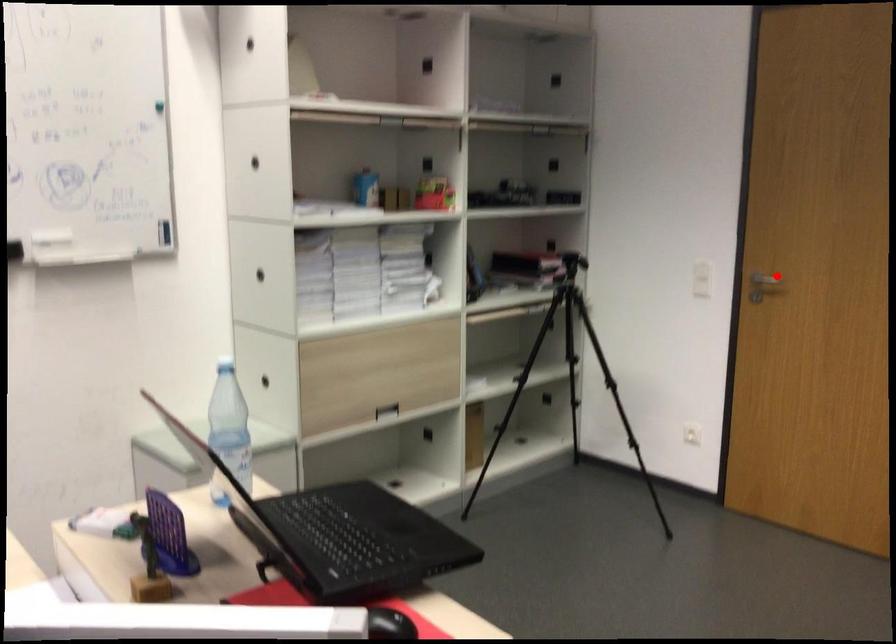
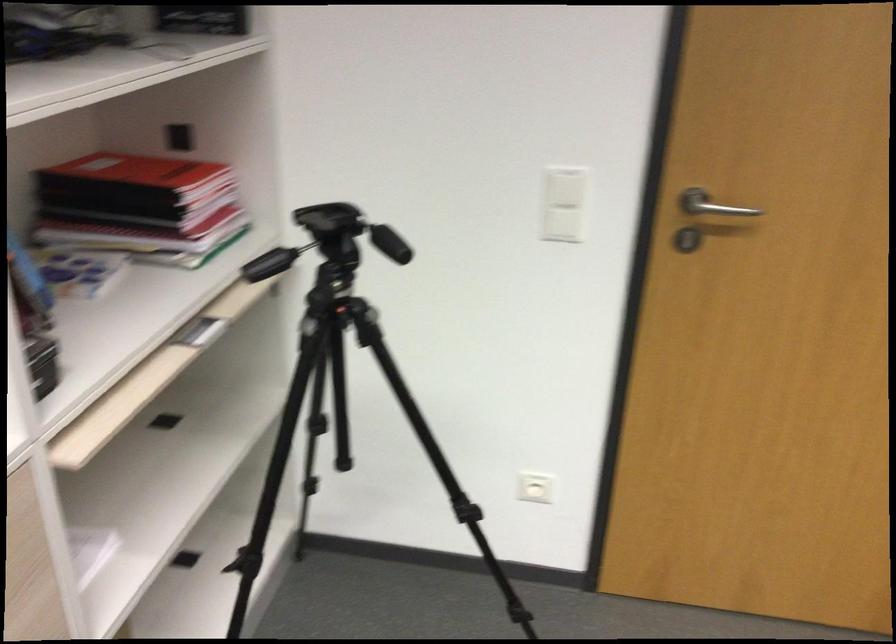
Question: I am providing you with two images of the same scene from different viewpoints. Image1 has a red point marked. In image2, the corresponding 3D location appears at what relative position? Reply with the corresponding letter.

Choices:
 (A) Closer
 (B) Farther

Answer: (A)